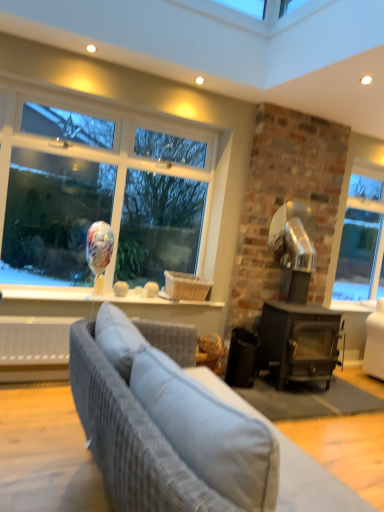
Question: Is textured gray fabric couch at lower left taller or shorter than dark gray wood stove at right?

Choices:
 (A) tall
 (B) short

Answer: (B)

Question: Visually, is textured gray fabric couch at lower left positioned to the left or to the right of dark gray wood stove at right?

Choices:
 (A) left
 (B) right

Answer: (A)

Question: From the image's perspective, is textured gray fabric couch at lower left above or below dark gray wood stove at right?

Choices:
 (A) below
 (B) above

Answer: (A)

Question: Which is correct: dark gray wood stove at right is inside textured gray fabric couch at lower left, or outside of it?

Choices:
 (A) outside
 (B) inside

Answer: (A)

Question: Considering the positions of point (276, 256) and point (100, 471), is point (276, 256) closer or farther from the camera than point (100, 471)?

Choices:
 (A) closer
 (B) farther

Answer: (B)

Question: From the image's perspective, is dark gray wood stove at right above or below textured gray fabric couch at lower left?

Choices:
 (A) below
 (B) above

Answer: (B)

Question: From their relative heights in the image, would you say dark gray wood stove at right is taller or shorter than textured gray fabric couch at lower left?

Choices:
 (A) short
 (B) tall

Answer: (B)